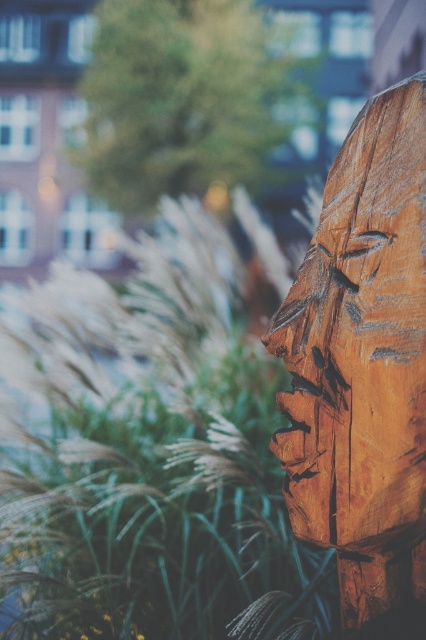
Question: Which of the following is the farthest from the observer?

Choices:
 (A) (2, 509)
 (B) (382, 548)

Answer: (A)

Question: Which of the following is the closest to the observer?

Choices:
 (A) (155, 436)
 (B) (400, 540)

Answer: (B)

Question: Can you confirm if green grass at left is smaller than natural wood carving at right?

Choices:
 (A) yes
 (B) no

Answer: (B)

Question: Which point appears farthest from the camera in this image?

Choices:
 (A) (23, 588)
 (B) (282, 464)

Answer: (A)

Question: Is the position of green grass at left more distant than that of natural wood carving at right?

Choices:
 (A) yes
 (B) no

Answer: (A)

Question: Considering the relative positions of green grass at left and natural wood carving at right in the image provided, where is green grass at left located with respect to natural wood carving at right?

Choices:
 (A) above
 (B) below

Answer: (B)